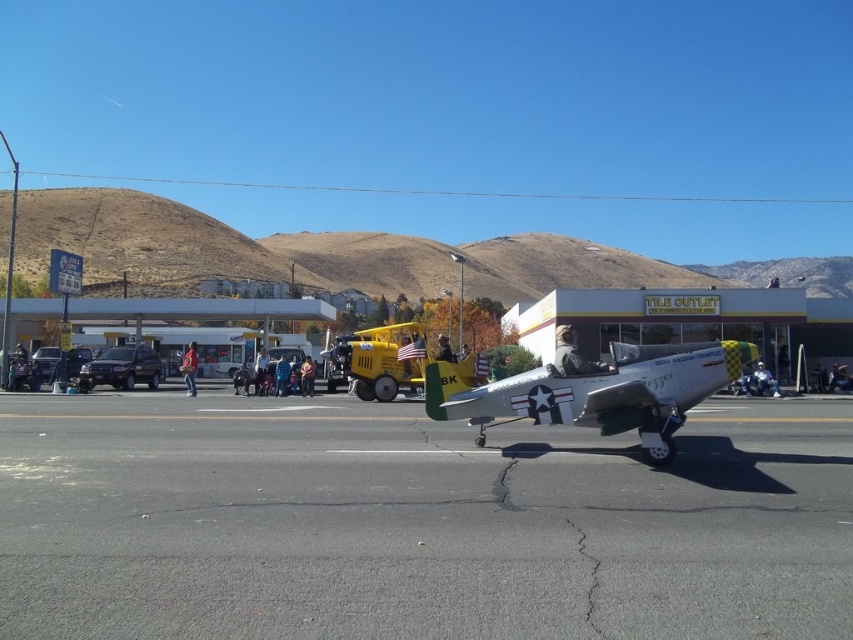
Does gray asphalt at center appear on the right side of silver metallic airplane at center?

Incorrect, gray asphalt at center is not on the right side of silver metallic airplane at center.

Can you confirm if gray asphalt at center is wider than silver metallic airplane at center?

Yes, gray asphalt at center is wider than silver metallic airplane at center.

Who is more forward, (x=563, y=513) or (x=436, y=403)?

Point (x=563, y=513) is in front.

At what (x,y) coordinates should I click in order to perform the action: click on gray asphalt at center. Please return your answer as a coordinate pair (x, y). Looking at the image, I should click on (416, 524).